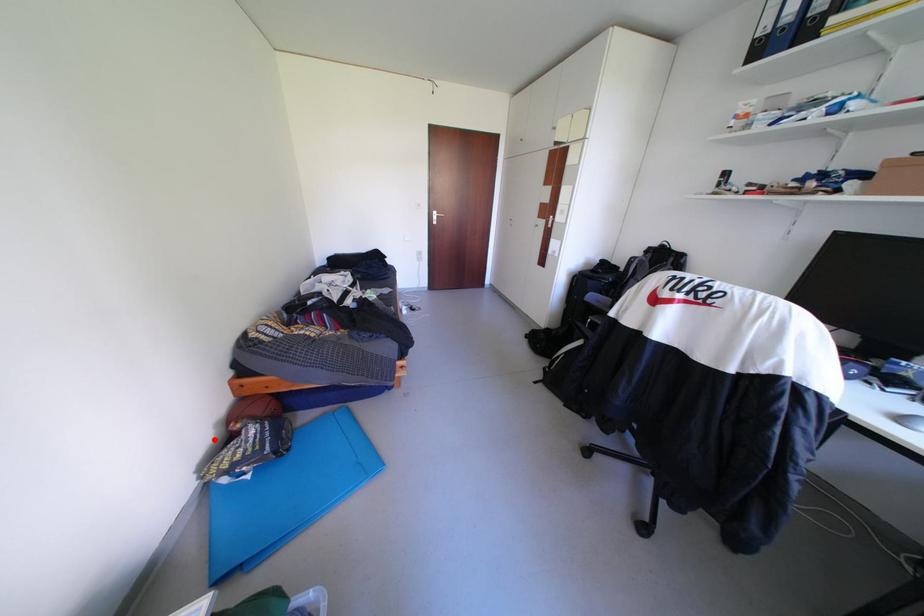
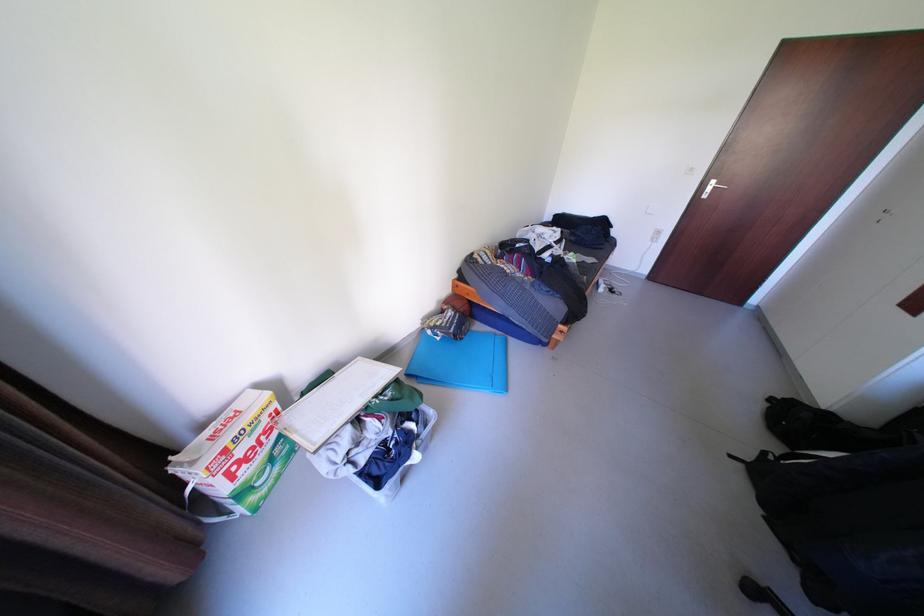
Locate, in the second image, the point that corresponds to the highlighted location in the first image.

(441, 305)